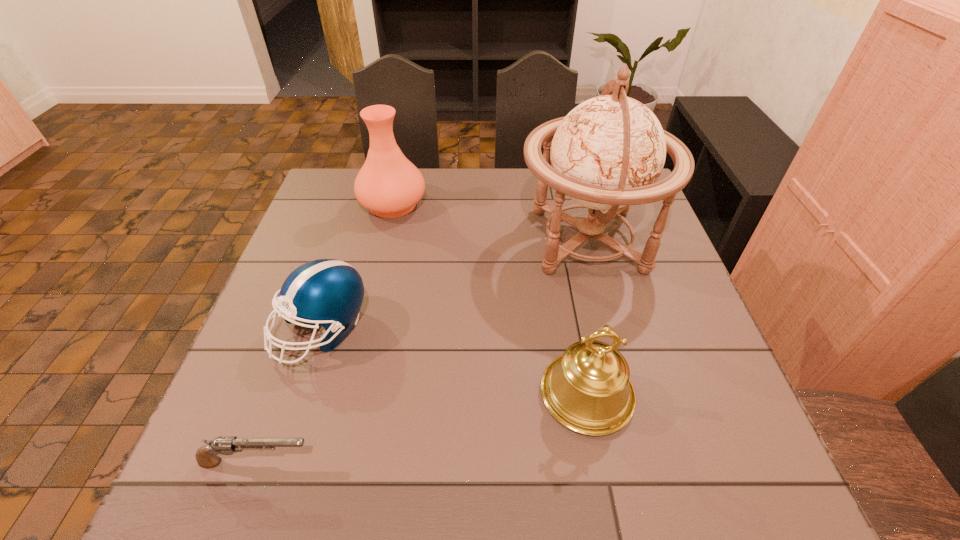
Image resolution: width=960 pixels, height=540 pixels. I want to click on unoccupied area between the fourth tallest object and the bell, so click(455, 362).

Where is `vacant region between the shortest object and the globe`? vacant region between the shortest object and the globe is located at coordinates (422, 351).

I want to click on unoccupied position between the third shortest object and the shortest object, so click(422, 428).

Locate an element on the screen. The height and width of the screenshot is (540, 960). free space between the third shortest object and the vase is located at coordinates (490, 299).

The width and height of the screenshot is (960, 540). I want to click on vacant space that's between the tallest object and the second tallest object, so click(x=491, y=222).

Identify the location of free space between the fourth tallest object and the shortest object. This screenshot has width=960, height=540. (290, 396).

At what (x,y) coordinates should I click in order to perform the action: click on free space between the second shortest object and the vase. Please return your answer as a coordinate pair (x, y). Looking at the image, I should click on (357, 267).

Identify the location of empty space between the football helmet and the third tallest object. This screenshot has height=540, width=960. (455, 362).

Locate an element on the screen. This screenshot has height=540, width=960. free area in between the globe and the third shortest object is located at coordinates (588, 317).

The width and height of the screenshot is (960, 540). In order to click on the closest object to the vase in this screenshot , I will do `click(607, 153)`.